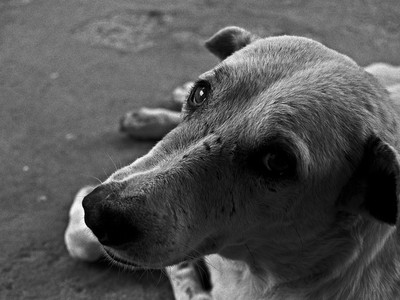
Find the location of a particular element. large spot in rug is located at coordinates (136, 24), (122, 31).